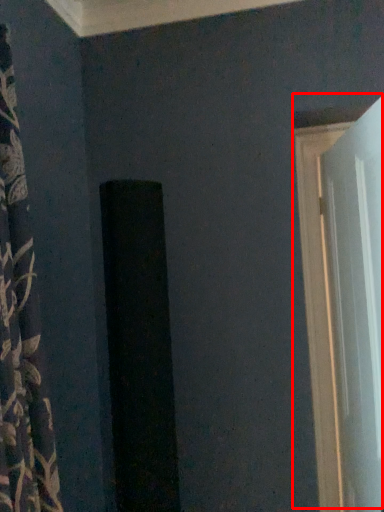
Question: In this image, where is door (annotated by the red box) located relative to curtain?

Choices:
 (A) right
 (B) left

Answer: (A)